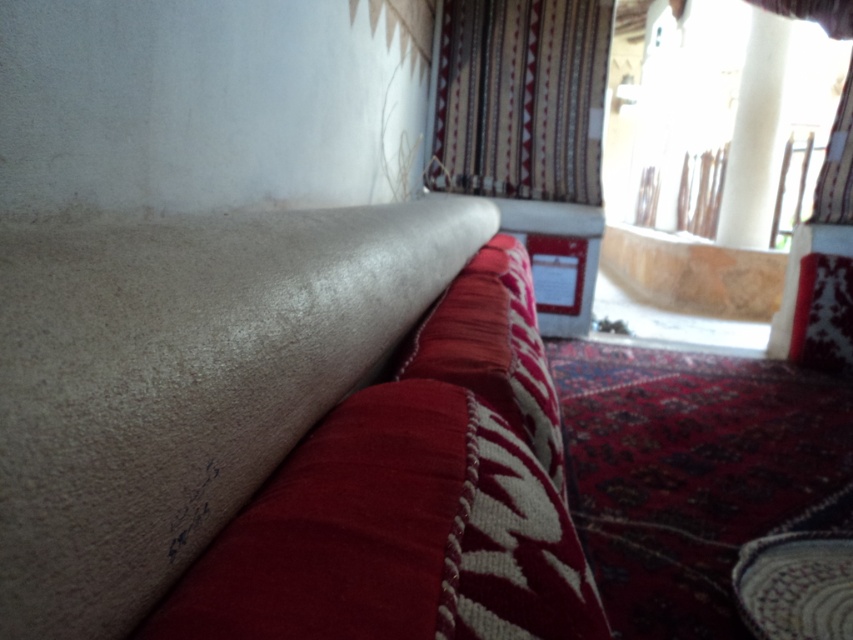
Which is more to the right, suede-like beige couch at upper left or patterned fabric curtain at upper center?

From the viewer's perspective, patterned fabric curtain at upper center appears more on the right side.

Who is more distant from viewer, (x=321, y=632) or (x=492, y=0)?

The point (x=492, y=0) is behind.

At what (x,y) coordinates should I click in order to perform the action: click on suede-like beige couch at upper left. Please return your answer as a coordinate pair (x, y). Looking at the image, I should click on (282, 433).

From the picture: Does patterned fabric curtain at upper center appear under white smooth column at upper right?

Yes, patterned fabric curtain at upper center is below white smooth column at upper right.

Is point (482, 118) more distant than point (735, 202)?

That is False.

The image size is (853, 640). Identify the location of patterned fabric curtain at upper center. (521, 99).

Based on the photo, does suede-like beige couch at upper left have a lesser width compared to white smooth column at upper right?

Incorrect, suede-like beige couch at upper left's width is not less than white smooth column at upper right's.

Who is lower down, suede-like beige couch at upper left or white smooth column at upper right?

Positioned lower is suede-like beige couch at upper left.

This screenshot has height=640, width=853. I want to click on suede-like beige couch at upper left, so click(282, 433).